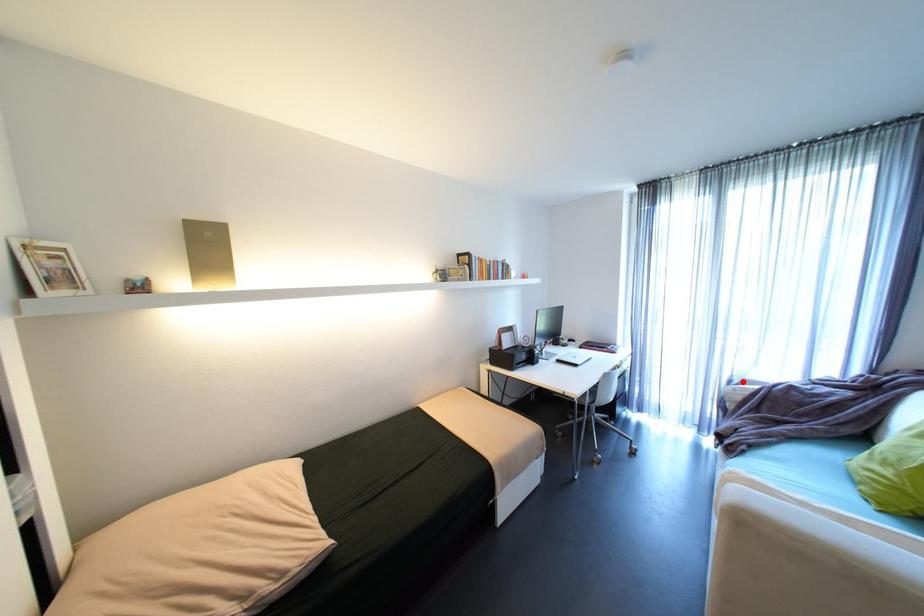
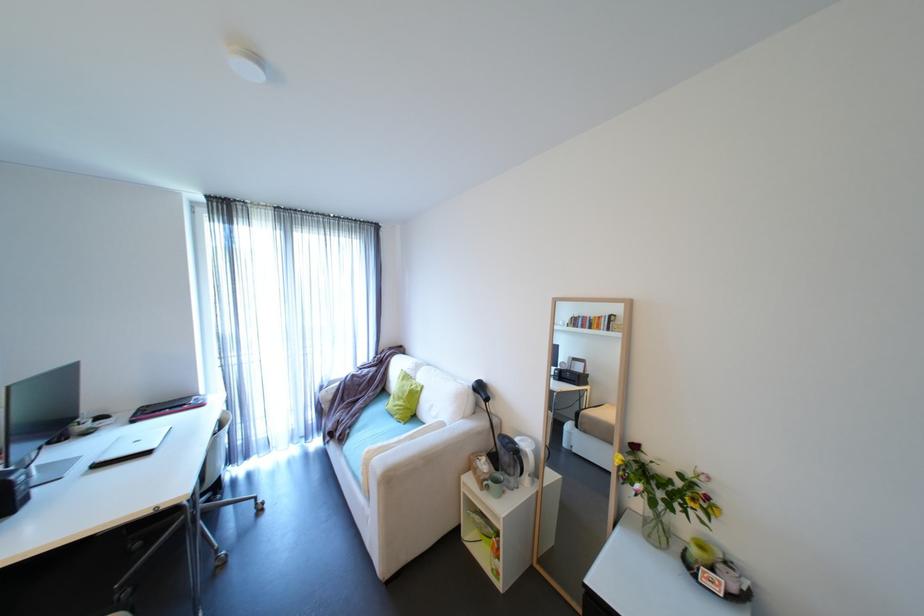
Question: A red point is marked in image1. In image2, is the corresponding 3D point closer to the camera or farther? Reply with the corresponding letter.

Choices:
 (A) The corresponding 3D point is closer.
 (B) The corresponding 3D point is farther.

Answer: (B)